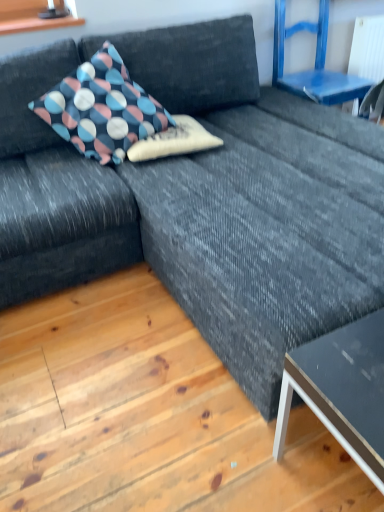
Question: Is polka dot fabric pillow at upper left, the 1th pillow in the left-to-right sequence, in contact with blue painted wood chair at upper right?

Choices:
 (A) yes
 (B) no

Answer: (B)

Question: Considering the relative sizes of polka dot fabric pillow at upper left, the 2th pillow viewed from the right, and blue painted wood chair at upper right in the image provided, is polka dot fabric pillow at upper left, the 2th pillow viewed from the right, thinner than blue painted wood chair at upper right?

Choices:
 (A) yes
 (B) no

Answer: (B)

Question: Is polka dot fabric pillow at upper left, the 2th pillow viewed from the right, far from blue painted wood chair at upper right?

Choices:
 (A) yes
 (B) no

Answer: (A)

Question: Is polka dot fabric pillow at upper left, the 2th pillow viewed from the right, shorter than blue painted wood chair at upper right?

Choices:
 (A) yes
 (B) no

Answer: (A)

Question: Can you confirm if polka dot fabric pillow at upper left, the 2th pillow viewed from the right, is taller than blue painted wood chair at upper right?

Choices:
 (A) no
 (B) yes

Answer: (A)

Question: From the image's perspective, is matte black table at lower right positioned above or below polka dot fabric pillow at center, which is the first pillow in right-to-left order?

Choices:
 (A) above
 (B) below

Answer: (B)

Question: Is matte black table at lower right to the left or to the right of polka dot fabric pillow at center, positioned as the 2th pillow in left-to-right order, in the image?

Choices:
 (A) right
 (B) left

Answer: (A)

Question: Is matte black table at lower right in front of or behind polka dot fabric pillow at center, positioned as the 2th pillow in left-to-right order, in the image?

Choices:
 (A) behind
 (B) front

Answer: (B)

Question: Is matte black table at lower right wider or thinner than polka dot fabric pillow at center, positioned as the 2th pillow in left-to-right order?

Choices:
 (A) wide
 (B) thin

Answer: (B)

Question: Considering the positions of polka dot fabric pillow at upper left, the 2th pillow viewed from the right, and blue painted wood chair at upper right in the image, is polka dot fabric pillow at upper left, the 2th pillow viewed from the right, bigger or smaller than blue painted wood chair at upper right?

Choices:
 (A) small
 (B) big

Answer: (A)

Question: In terms of height, does polka dot fabric pillow at upper left, the 1th pillow in the left-to-right sequence, look taller or shorter compared to blue painted wood chair at upper right?

Choices:
 (A) tall
 (B) short

Answer: (B)

Question: Is polka dot fabric pillow at upper left, the 2th pillow viewed from the right, spatially inside blue painted wood chair at upper right, or outside of it?

Choices:
 (A) outside
 (B) inside

Answer: (A)

Question: Visually, is polka dot fabric pillow at upper left, the 2th pillow viewed from the right, positioned to the left or to the right of blue painted wood chair at upper right?

Choices:
 (A) right
 (B) left

Answer: (B)

Question: From the image's perspective, relative to matte black table at lower right, is polka dot fabric pillow at upper left, the 2th pillow viewed from the right, above or below?

Choices:
 (A) below
 (B) above

Answer: (B)

Question: Is polka dot fabric pillow at upper left, the 2th pillow viewed from the right, in front of or behind matte black table at lower right in the image?

Choices:
 (A) behind
 (B) front

Answer: (A)